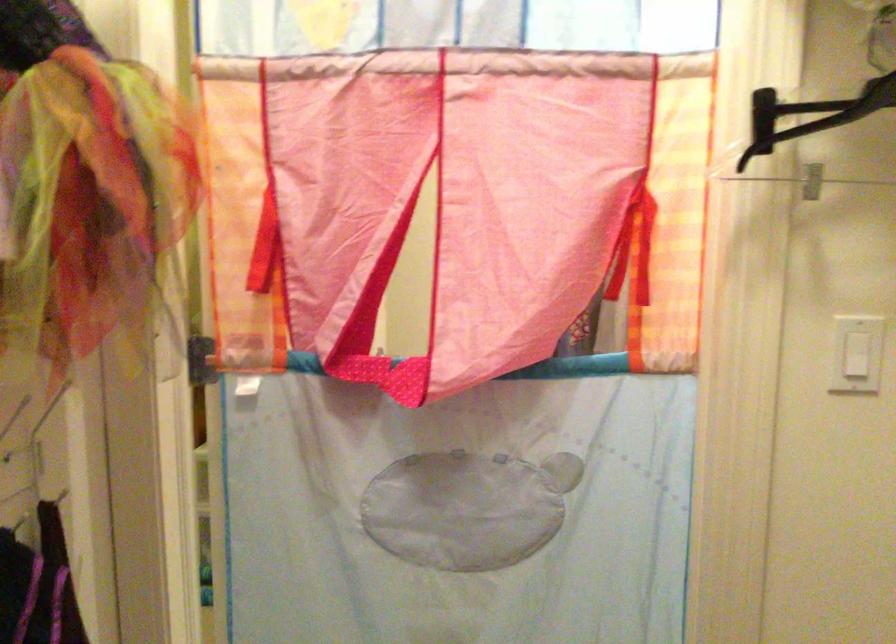
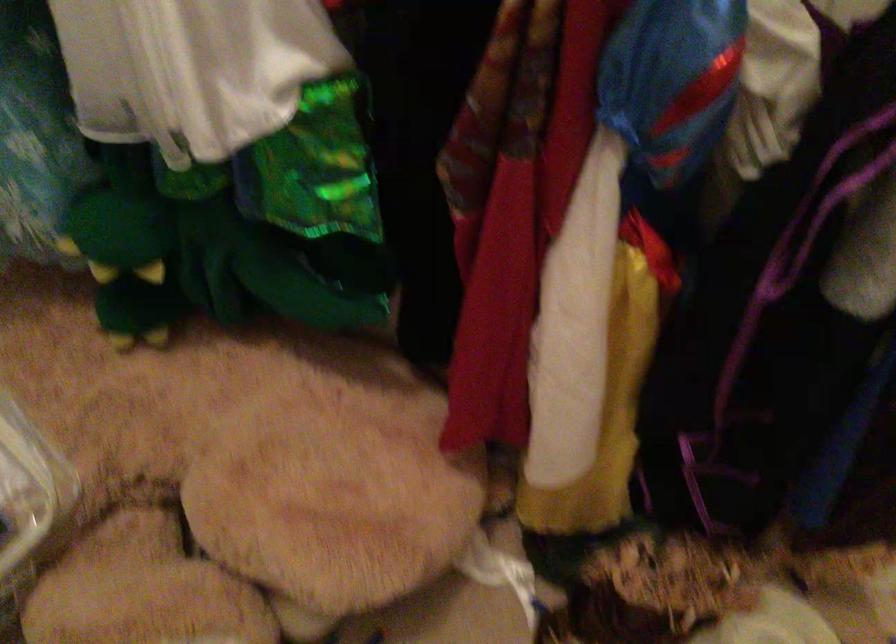
Based on the continuous images, in which direction is the camera rotating?

The camera rotated toward left-down.